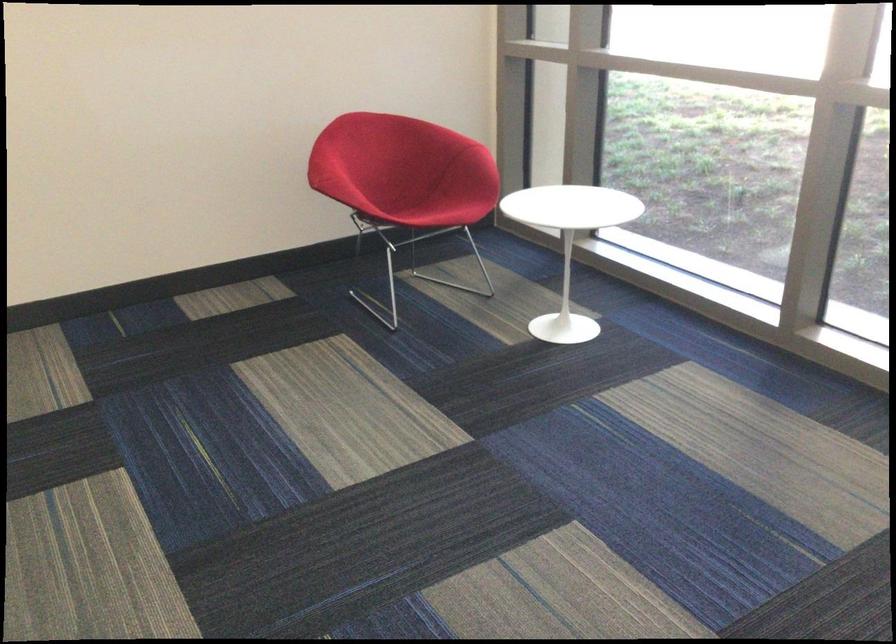
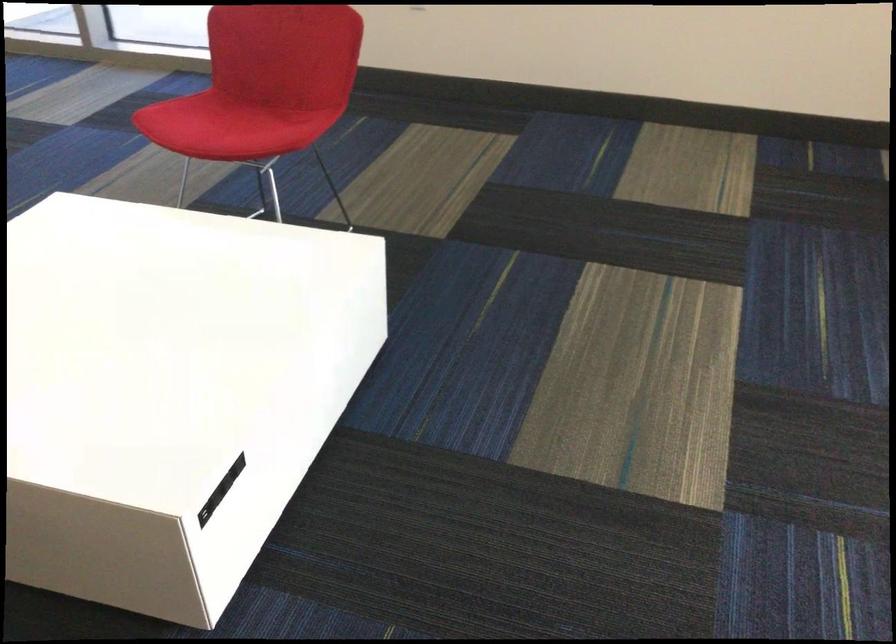
Based on the continuous images, in which direction is the camera rotating?

The rotation direction of the camera is left-down.